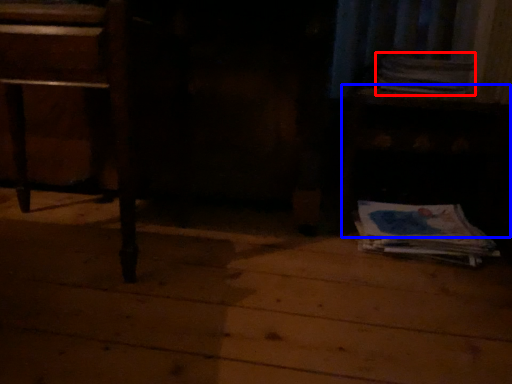
Question: Which object appears farthest to the camera in this image, paperback book (highlighted by a red box) or table (highlighted by a blue box)?

Choices:
 (A) paperback book
 (B) table

Answer: (A)